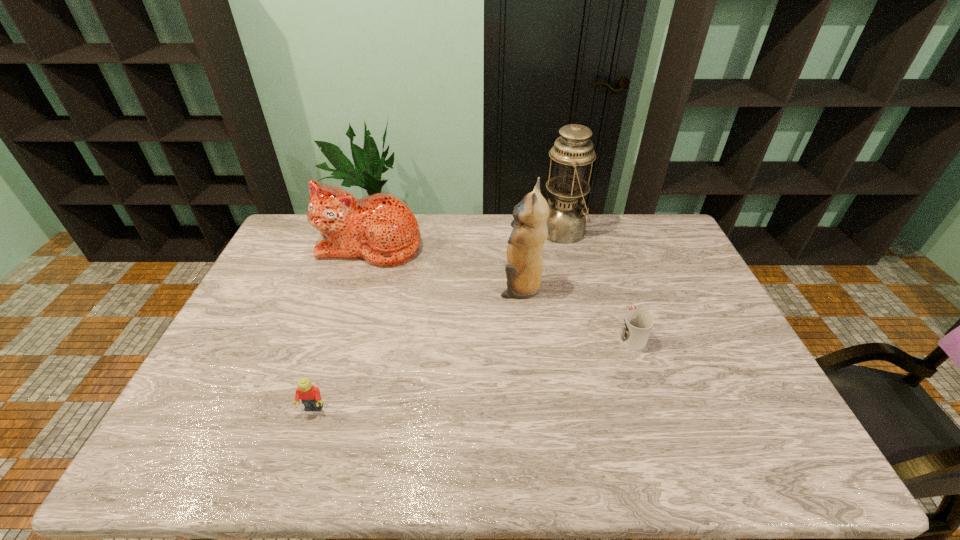
Locate an element on the screen. Image resolution: width=960 pixels, height=540 pixels. vacant space located 0.350m on the face of the nearer cat is located at coordinates (393, 287).

Where is `vacant area located 0.240m on the face of the nearer cat`? The image size is (960, 540). vacant area located 0.240m on the face of the nearer cat is located at coordinates (426, 287).

Locate an element on the screen. The width and height of the screenshot is (960, 540). vacant position located on the face of the nearer cat is located at coordinates (398, 287).

You are a GUI agent. You are given a task and a screenshot of the screen. Output one action in this format:
    pyautogui.click(x=<x>, y=<y>)
    Task: Click on the vacant space located 0.090m on the face of the third shortest object
    
    Given the screenshot: What is the action you would take?
    pyautogui.click(x=357, y=286)

This screenshot has height=540, width=960. What are the coordinates of `vacant region located on the face of the nearest object` in the screenshot? It's located at (301, 447).

The width and height of the screenshot is (960, 540). What are the coordinates of `blank space located 0.050m on the handle side of the cup` in the screenshot? It's located at (622, 310).

Find the location of a particular element. free space located 0.150m on the handle side of the cup is located at coordinates (614, 288).

You are a GUI agent. You are given a task and a screenshot of the screen. Output one action in this format:
    pyautogui.click(x=<x>, y=<y>)
    Task: Click on the vacant space located 0.340m on the handle side of the cup
    This screenshot has width=960, height=540.
    Given the screenshot: What is the action you would take?
    (x=603, y=252)

This screenshot has height=540, width=960. What are the coordinates of `oil lamp that is at the far edge` in the screenshot? It's located at (572, 152).

The height and width of the screenshot is (540, 960). In order to click on cat at the far edge in this screenshot , I will do `click(380, 228)`.